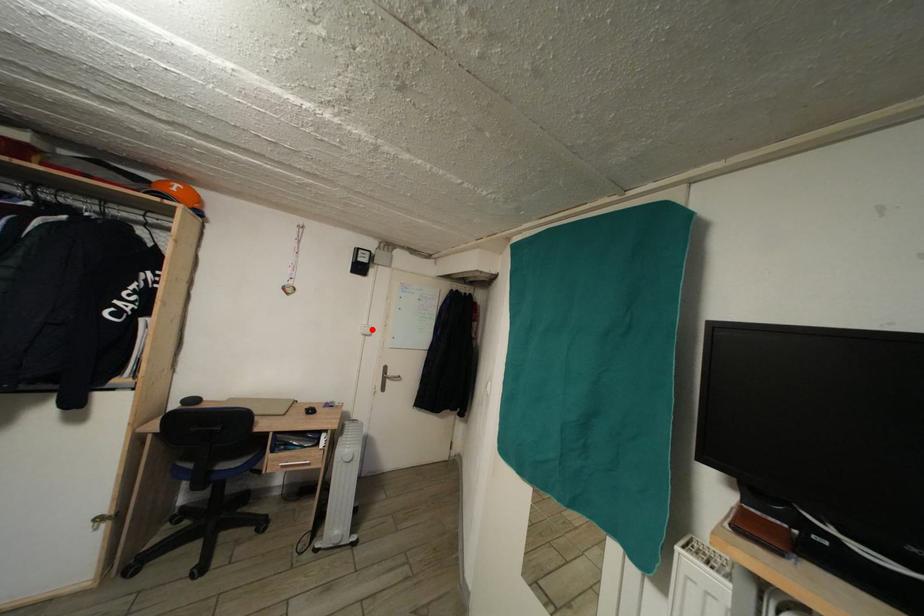
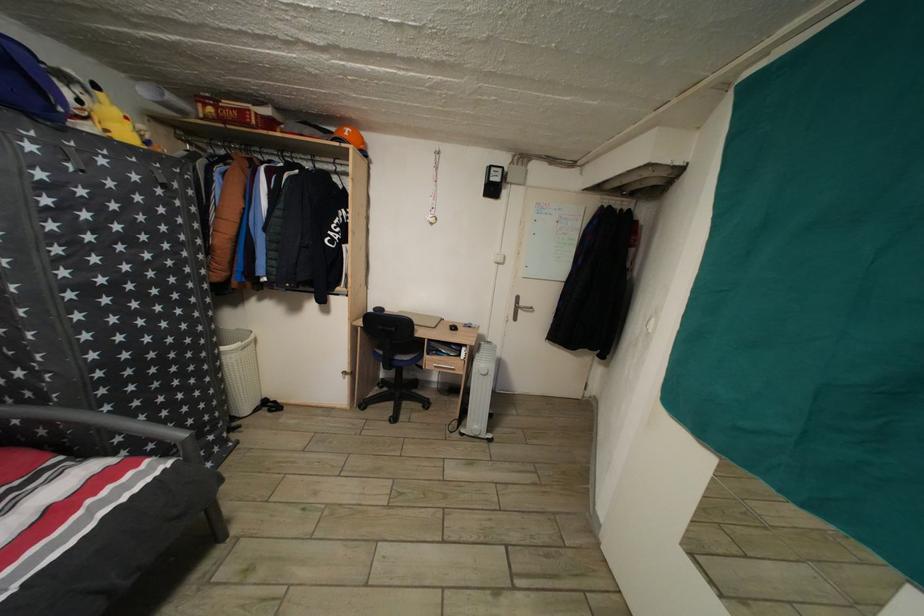
Find the pixel in the second image that matches the highlighted location in the first image.

(505, 257)